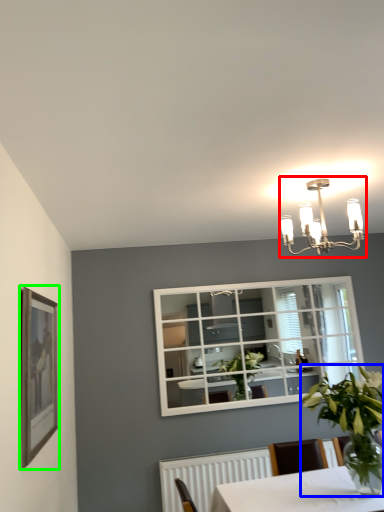
Question: Which object is positioned farthest from lamp (highlighted by a red box)? Select from houseplant (highlighted by a blue box) and picture frame (highlighted by a green box).

Choices:
 (A) houseplant
 (B) picture frame

Answer: (B)